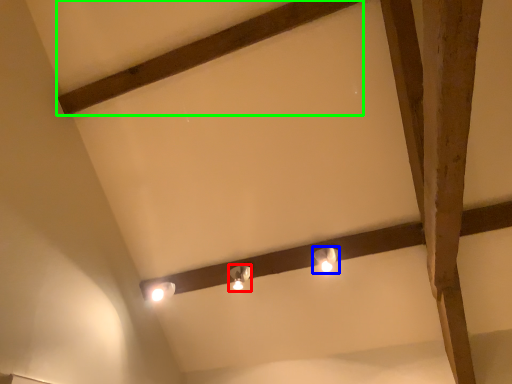
Question: Which is nearer to the lamp (highlighted by a red box)? lamp (highlighted by a blue box) or plank (highlighted by a green box).

Choices:
 (A) lamp
 (B) plank

Answer: (A)